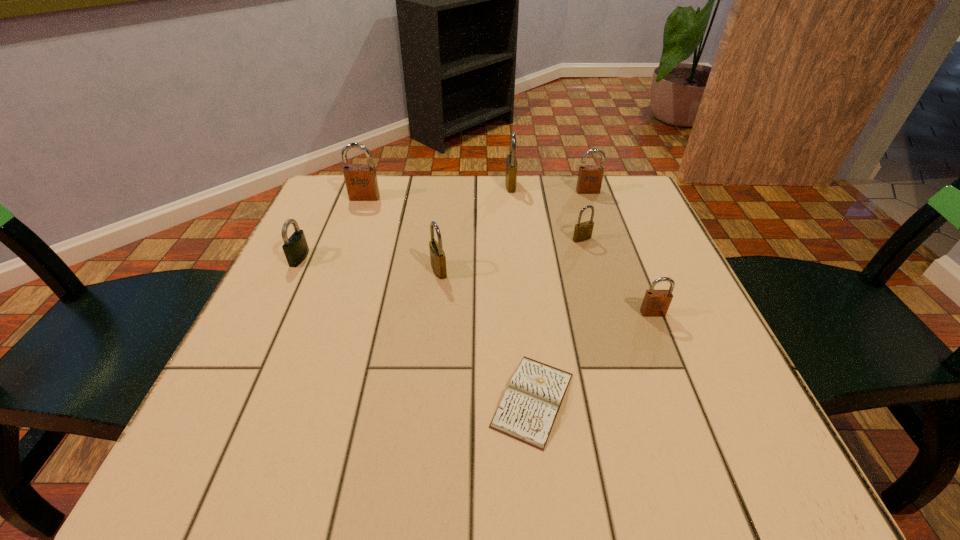
This screenshot has height=540, width=960. What are the coordinates of `free space between the shortest object and the sixth nearest object` in the screenshot? It's located at (448, 299).

Identify which object is the seventh nearest to the second brass padlock from right to left. Please provide its 2D coordinates. Your answer should be formatted as a tuple, i.e. [(x, y)], where the tuple contains the x and y coordinates of a point satisfying the conditions above.

[(528, 409)]

Identify the location of object that is the fifth closest to the fourth padlock from right to left. The height and width of the screenshot is (540, 960). (656, 303).

Where is `the closest padlock relative to the black padlock`? The image size is (960, 540). the closest padlock relative to the black padlock is located at coordinates (361, 182).

Locate an element on the screen. This screenshot has height=540, width=960. padlock that is the sixth closest one to the smallest brown padlock is located at coordinates (296, 249).

Locate an element on the screen. The width and height of the screenshot is (960, 540). brass padlock identified as the second closest to the second biggest brown padlock is located at coordinates (583, 231).

Identify the location of the second closest brass padlock relative to the black padlock. (511, 162).

I want to click on brown padlock that is the third closest to the leftmost padlock, so click(656, 303).

Point out which brown padlock is positioned as the third nearest to the smallest brass padlock. Please provide its 2D coordinates. Your answer should be formatted as a tuple, i.e. [(x, y)], where the tuple contains the x and y coordinates of a point satisfying the conditions above.

[(361, 182)]

This screenshot has width=960, height=540. I want to click on vacant space that satisfies the following two spatial constraints: 1. on the front-facing side of the second padlock from left to right; 2. on the right side of the fifth padlock from right to left, so click(x=338, y=271).